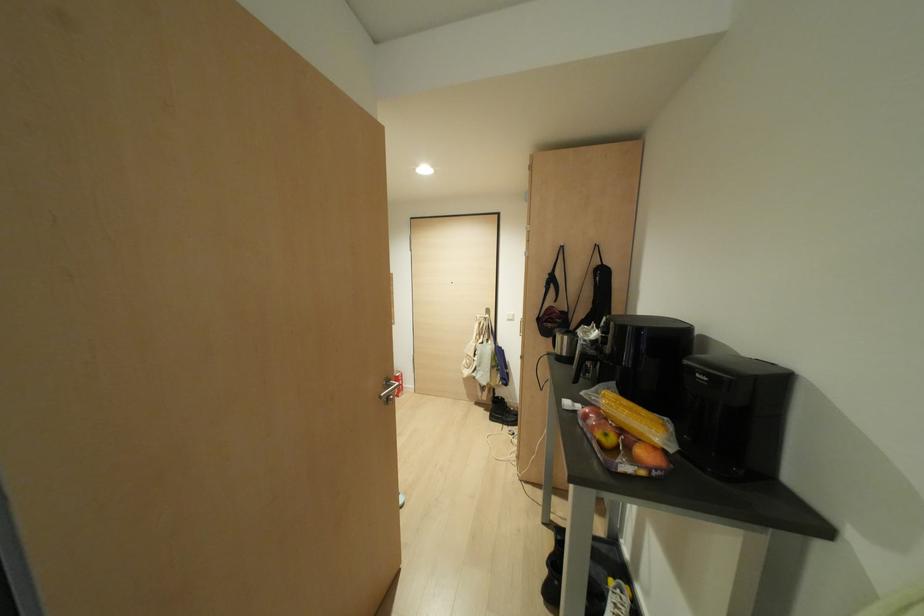
Identify the location of silver door handle. This screenshot has width=924, height=616. (390, 391).